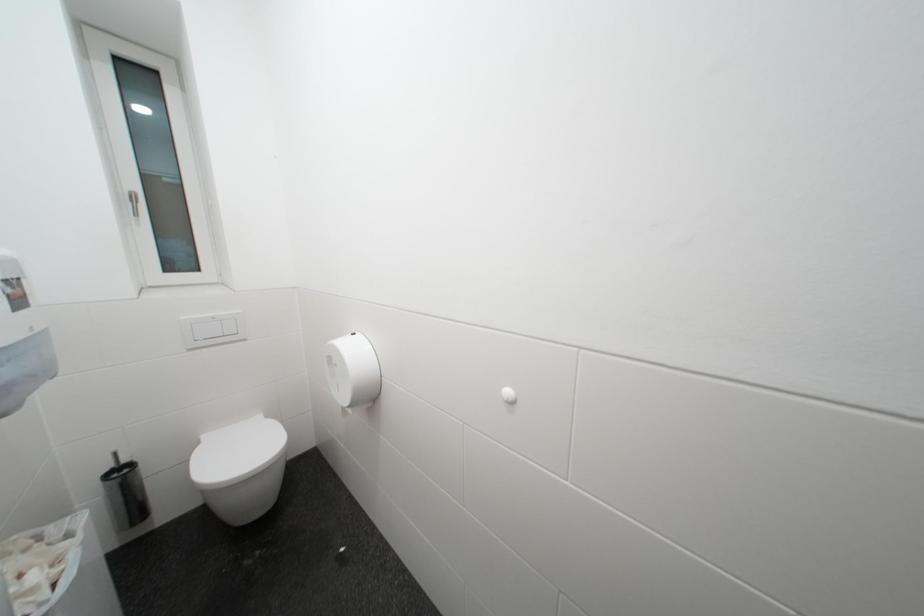
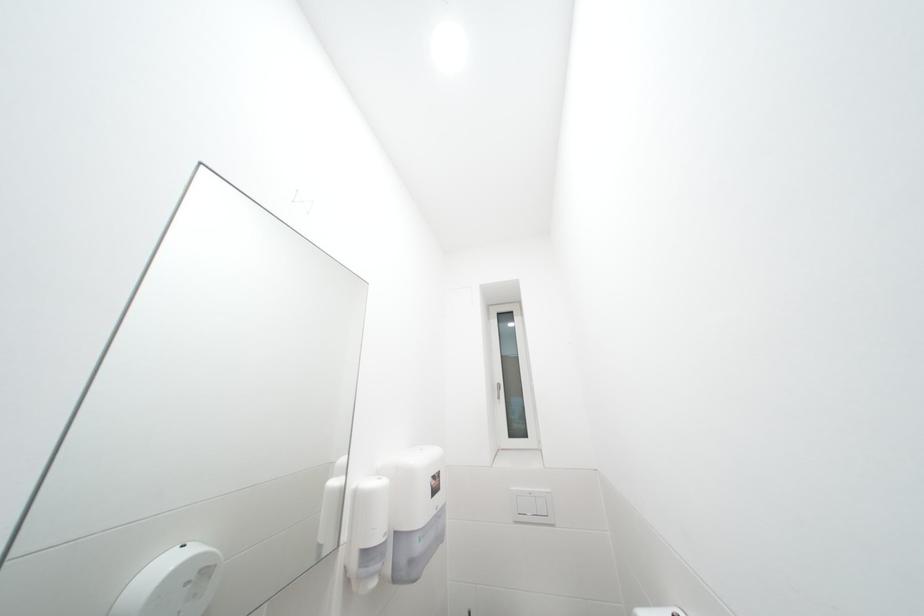
Based on the continuous images, in which direction is the camera rotating?

The rotation direction of the camera is left-up.